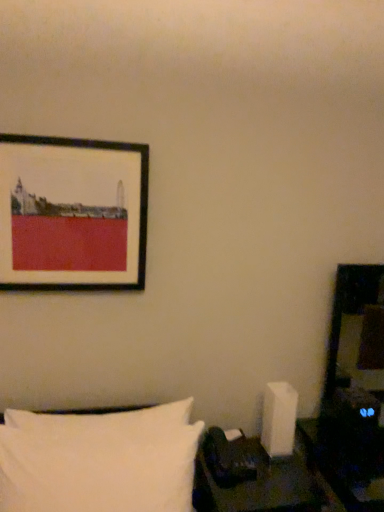
Question: From a real-world perspective, is matte black picture frame at upper left beneath black leather table at lower right?

Choices:
 (A) yes
 (B) no

Answer: (B)

Question: Considering the relative sizes of matte black picture frame at upper left and black leather table at lower right in the image provided, is matte black picture frame at upper left smaller than black leather table at lower right?

Choices:
 (A) yes
 (B) no

Answer: (A)

Question: Considering the relative positions of matte black picture frame at upper left and black leather table at lower right in the image provided, is matte black picture frame at upper left to the left of black leather table at lower right from the viewer's perspective?

Choices:
 (A) yes
 (B) no

Answer: (A)

Question: Is matte black picture frame at upper left not near black leather table at lower right?

Choices:
 (A) no
 (B) yes

Answer: (A)

Question: Is matte black picture frame at upper left further to the viewer compared to black leather table at lower right?

Choices:
 (A) yes
 (B) no

Answer: (A)

Question: Considering the relative sizes of matte black picture frame at upper left and black leather table at lower right in the image provided, is matte black picture frame at upper left shorter than black leather table at lower right?

Choices:
 (A) no
 (B) yes

Answer: (A)

Question: Does black leather table at lower right have a greater height compared to matte black picture frame at upper left?

Choices:
 (A) no
 (B) yes

Answer: (A)

Question: Is black leather table at lower right bigger than matte black picture frame at upper left?

Choices:
 (A) no
 (B) yes

Answer: (B)

Question: Is black leather table at lower right wider than matte black picture frame at upper left?

Choices:
 (A) no
 (B) yes

Answer: (B)

Question: Does black leather table at lower right have a smaller size compared to matte black picture frame at upper left?

Choices:
 (A) no
 (B) yes

Answer: (A)

Question: Can you confirm if black leather table at lower right is shorter than matte black picture frame at upper left?

Choices:
 (A) no
 (B) yes

Answer: (B)

Question: Is matte black picture frame at upper left completely or partially inside black leather table at lower right?

Choices:
 (A) yes
 (B) no

Answer: (B)

Question: Is white soft pillow at lower left completely or partially inside black leather table at lower right?

Choices:
 (A) no
 (B) yes

Answer: (A)